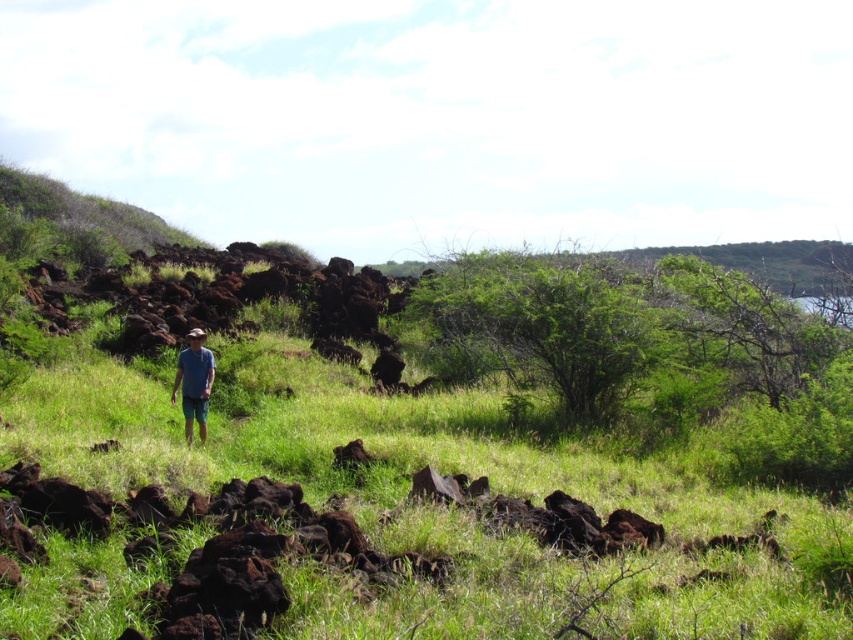
You are a photographer planning to take a picture of the brown rough rocks at center and the blue fabric shirt at center in the outdoor scene. Which object should be placed closer to the camera to ensure both are in focus?

The brown rough rocks at center is taller than the blue fabric shirt at center, so placing the brown rough rocks at center closer to the camera would help ensure both are in focus since they are of different heights.

You are standing on the grassy area in the image and want to place a small flag exactly at the center of the image. The brown rough rocks at center are in your way. Can you determine if the flag can be placed at the center without overlapping the rocks?

The brown rough rocks at center are located at point (404, 509), which is very close to the center of the image. Therefore, placing the flag at the exact center may overlap with the rocks.

You are a drone operator trying to capture a photo of the blue fabric shirt at center and the brown rough rocks at center. Your drone can only focus on objects within a 3 meter range. Will both objects be in focus if the drone is positioned equidistant from both?

The brown rough rocks at center is 3.74 meters away from blue fabric shirt at center. If the drone is equidistant between them, it would be 1.87 meters from each. Since the drone can focus within 3 meters, both objects will be in focus.